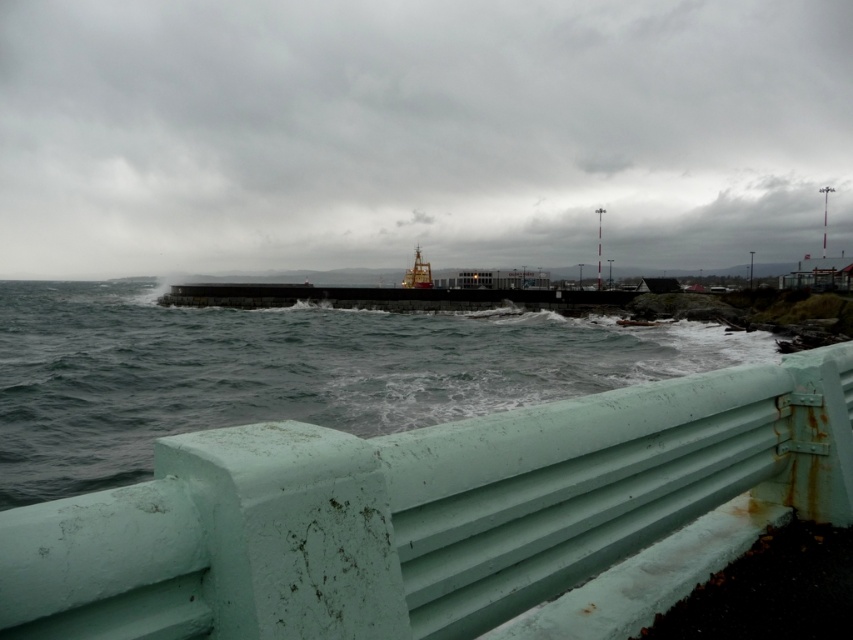
In the scene shown: You are standing at the edge of the scene and want to place a small weatherproof sensor exactly at the coordinates given for the white matte water at lower center. What are the coordinates where you should place the sensor?

The coordinates for the white matte water at lower center are at point (418, 132), so you should place the sensor there.

You are standing at the weathered teal metal railing in the foreground of the coastal scene. You see a white painted metal barrier at lower center marked by point (419, 512). If you want to walk towards this barrier, which direction should you move relative to the breakwater structure in the middle ground?

The white painted metal barrier at lower center marked by point (419, 512) is located in the lower center of the scene. Since you are at the weathered teal metal railing in the foreground, which is close to the viewer, you should move forward towards the middle ground where the breakwater structure is located. This direction aligns you with the barrier positioned at lower center relative to the breakwater in the middle ground.